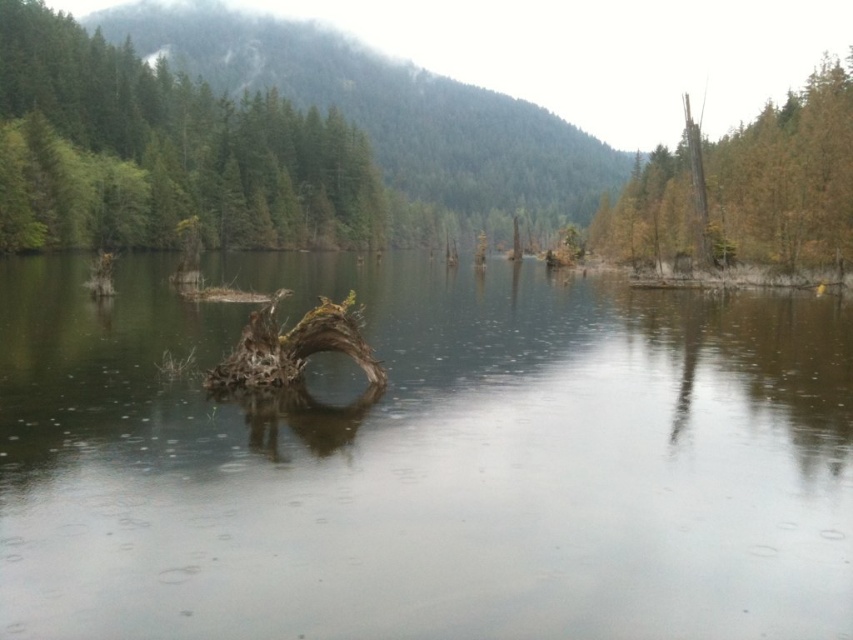
Question: Does brown wood tree stump at upper right lie in front of brown rough tree trunk at right?

Choices:
 (A) no
 (B) yes

Answer: (B)

Question: In this image, where is transparent water at center located relative to brown wood tree stump at upper right?

Choices:
 (A) left
 (B) right

Answer: (A)

Question: Is brown wood tree stump at upper right bigger than brown rough tree trunk at right?

Choices:
 (A) no
 (B) yes

Answer: (A)

Question: Which point appears closest to the camera in this image?

Choices:
 (A) (692, 220)
 (B) (698, 243)
 (C) (610, 595)

Answer: (C)

Question: Which point is closer to the camera taking this photo?

Choices:
 (A) (711, 243)
 (B) (515, 356)

Answer: (B)

Question: Among these objects, which one is farthest from the camera?

Choices:
 (A) brown rough tree trunk at right
 (B) transparent water at center

Answer: (A)